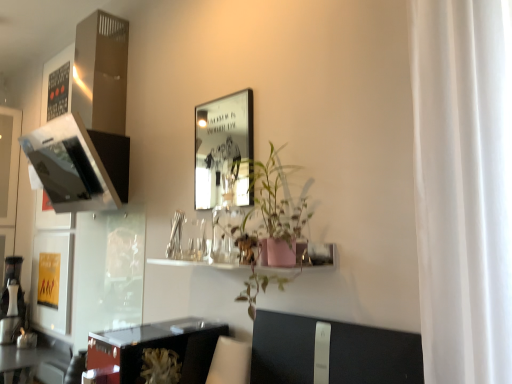
Describe the element at coordinates (306, 256) in the screenshot. I see `pink matte shelf at center` at that location.

Locate an element on the screen. transparent glass door at lower left is located at coordinates (108, 272).

Can you confirm if shiny black table at lower left, the 1th table when ordered from front to back, is bigger than pink matte shelf at center?

Correct, shiny black table at lower left, the 1th table when ordered from front to back, is larger in size than pink matte shelf at center.

Which is correct: shiny black table at lower left, the 1th table when ordered from front to back, is inside pink matte shelf at center, or outside of it?

shiny black table at lower left, the 1th table when ordered from front to back, lies outside pink matte shelf at center.

Which is behind, point (109, 351) or point (311, 264)?

The point (109, 351) is behind.

Is shiny black table at lower left, the second table from the bottom, shorter than pink matte shelf at center?

No, shiny black table at lower left, the second table from the bottom, is not shorter than pink matte shelf at center.

Considering the sizes of objects white plastic swivel chair at lower center and metallic silver picture frame at upper center in the image provided, who is taller, white plastic swivel chair at lower center or metallic silver picture frame at upper center?

Standing taller between the two is metallic silver picture frame at upper center.

Is white plastic swivel chair at lower center positioned beyond the bounds of metallic silver picture frame at upper center?

Absolutely, white plastic swivel chair at lower center is external to metallic silver picture frame at upper center.

From the image's perspective, is white plastic swivel chair at lower center over metallic silver picture frame at upper center?

Actually, white plastic swivel chair at lower center appears below metallic silver picture frame at upper center in the image.

Is white plastic swivel chair at lower center oriented towards metallic silver picture frame at upper center?

No.

Consider the image. Is pink matte shelf at center smaller than white plastic swivel chair at lower center?

No, pink matte shelf at center is not smaller than white plastic swivel chair at lower center.

Is white plastic swivel chair at lower center a part of pink matte shelf at center?

That's incorrect, white plastic swivel chair at lower center is not inside pink matte shelf at center.

Are pink matte shelf at center and white plastic swivel chair at lower center beside each other?

pink matte shelf at center and white plastic swivel chair at lower center are not in contact.

Where is `shelf that is on the right side of white plastic swivel chair at lower center`? shelf that is on the right side of white plastic swivel chair at lower center is located at coordinates (306, 256).

Is transparent glass door at lower left completely or partially inside pink matte shelf at center?

No, transparent glass door at lower left is not inside pink matte shelf at center.

Looking at this image, from a real-world perspective, is pink matte shelf at center above or below transparent glass door at lower left?

pink matte shelf at center is situated higher than transparent glass door at lower left in the real world.

Which is in front, pink matte shelf at center or transparent glass door at lower left?

pink matte shelf at center is more forward.

From the image's perspective, is pink matte shelf at center positioned above or below transparent glass door at lower left?

pink matte shelf at center is above transparent glass door at lower left.

Is point (73, 322) positioned behind point (217, 367)?

That is True.

Looking at this image, is transparent glass door at lower left facing towards white plastic swivel chair at lower center?

No.

Based on their positions, is transparent glass door at lower left located to the left or right of white plastic swivel chair at lower center?

In the image, transparent glass door at lower left appears on the left side of white plastic swivel chair at lower center.

Can you tell me how much transparent glass door at lower left and white plastic swivel chair at lower center differ in facing direction?

2.39 degrees separate the facing orientations of transparent glass door at lower left and white plastic swivel chair at lower center.

Is point (258, 191) behind point (306, 245)?

Yes, it is.

Is pink matte plant at center looking in the opposite direction of pink matte shelf at center?

No, pink matte plant at center's orientation is not away from pink matte shelf at center.

Based on their sizes in the image, would you say pink matte plant at center is bigger or smaller than shiny black table at lower left, placed as the second table when sorted from left to right?

Clearly, pink matte plant at center is smaller in size than shiny black table at lower left, placed as the second table when sorted from left to right.

Considering the relative positions of pink matte plant at center and shiny black table at lower left, which appears as the 1th table when viewed from the right, in the image provided, is pink matte plant at center to the left or to the right of shiny black table at lower left, which appears as the 1th table when viewed from the right,?

Based on their positions, pink matte plant at center is located to the right of shiny black table at lower left, which appears as the 1th table when viewed from the right.

How different are the orientations of pink matte plant at center and shiny black table at lower left, the 1th table when ordered from front to back, in degrees?

The angular difference between pink matte plant at center and shiny black table at lower left, the 1th table when ordered from front to back, is 1.09 degrees.

Between pink matte plant at center and shiny black table at lower left, the 1th table when ordered from front to back, which one is positioned in front?

shiny black table at lower left, the 1th table when ordered from front to back, is closer to the camera.

This screenshot has height=384, width=512. I want to click on table that is the 1st object directly below the pink matte shelf at center (from a real-world perspective), so click(x=158, y=350).

Locate an element on the screen. picture frame above the white plastic swivel chair at lower center (from a real-world perspective) is located at coordinates (224, 151).

Estimate the real-world distances between objects in this image. Which object is closer to metallic silver picture frame at upper center, transparent glass door at lower left or shiny black table at lower left, acting as the 2th table starting from the right?

transparent glass door at lower left is closer to metallic silver picture frame at upper center.

Consider the image. When comparing their distances from transparent glass door at lower left, does metallic silver picture frame at upper center or shiny black table at lower left, placed as the 1th table when sorted from top to bottom, seem further?

The object further to transparent glass door at lower left is metallic silver picture frame at upper center.

From the image, which object appears to be nearer to metallic silver picture frame at upper center, shiny black table at lower left, the second table from the bottom, or shiny black table at lower left, which is the 2th table in front-to-back order?

shiny black table at lower left, which is the 2th table in front-to-back order, is positioned closer to the anchor metallic silver picture frame at upper center.

Considering their positions, is shiny black table at lower left, placed as the 1th table when sorted from top to bottom, positioned closer to metallic silver picture frame at upper center than pink matte shelf at center?

shiny black table at lower left, placed as the 1th table when sorted from top to bottom, lies closer to metallic silver picture frame at upper center than the other object.

Estimate the real-world distances between objects in this image. Which object is further from shiny black table at lower left, placed as the 1th table when sorted from back to front, white plastic swivel chair at lower center or shiny black table at lower left, placed as the 2th table when sorted from back to front?

white plastic swivel chair at lower center is positioned further to the anchor shiny black table at lower left, placed as the 1th table when sorted from back to front.

Estimate the real-world distances between objects in this image. Which object is further from shiny black table at lower left, the 1th table when ordered from front to back, pink matte plant at center or shiny black table at lower left, the 1th table viewed from the left?

shiny black table at lower left, the 1th table viewed from the left.

Which object lies further to the anchor point white plastic swivel chair at lower center, shiny black table at lower left, placed as the 2th table when sorted from back to front, or shiny black table at lower left, which is the first table in bottom-to-top order?

Among the two, shiny black table at lower left, which is the first table in bottom-to-top order, is located further to white plastic swivel chair at lower center.

Looking at the image, which one is located further to metallic silver picture frame at upper center, white plastic swivel chair at lower center or shiny black table at lower left, placed as the 1th table when sorted from back to front?

Based on the image, white plastic swivel chair at lower center appears to be further to metallic silver picture frame at upper center.

Where is `swivel chair between transparent glass door at lower left and pink matte plant at center from left to right`? This screenshot has height=384, width=512. swivel chair between transparent glass door at lower left and pink matte plant at center from left to right is located at coordinates (230, 362).

The height and width of the screenshot is (384, 512). Identify the location of table between shiny black table at lower left, which is the first table in bottom-to-top order, and pink matte shelf at center. [158, 350].

The width and height of the screenshot is (512, 384). I want to click on table that lies between pink matte shelf at center and white plastic swivel chair at lower center from top to bottom, so click(158, 350).

You are a GUI agent. You are given a task and a screenshot of the screen. Output one action in this format:
    pyautogui.click(x=<x>, y=<y>)
    Task: Click on the houseplant between shiny black table at lower left, the 1th table when ordered from front to back, and transparent glass door at lower left from front to back
    The height and width of the screenshot is (384, 512).
    Given the screenshot: What is the action you would take?
    pyautogui.click(x=271, y=213)